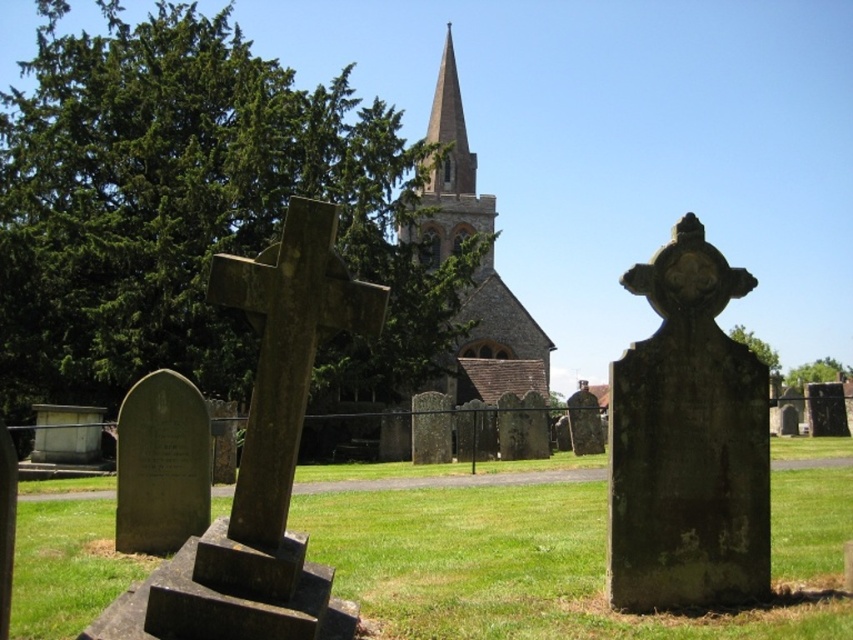
Question: Does brown stone cross at center lie behind smooth stone church steeple at center?

Choices:
 (A) yes
 (B) no

Answer: (B)

Question: Which point is farther to the camera?

Choices:
 (A) (544, 465)
 (B) (454, 115)
 (C) (245, 502)
 (D) (482, 384)

Answer: (B)

Question: Can you confirm if green grass at center is positioned below brown stone spire at center?

Choices:
 (A) yes
 (B) no

Answer: (A)

Question: Considering the relative positions of brown stone cross at center and smooth stone church steeple at center in the image provided, where is brown stone cross at center located with respect to smooth stone church steeple at center?

Choices:
 (A) right
 (B) left

Answer: (B)

Question: Which point is farther to the camera?

Choices:
 (A) brown stone spire at center
 (B) brown stone cross at center

Answer: (A)

Question: Which of the following is the farthest from the observer?

Choices:
 (A) (503, 355)
 (B) (573, 554)
 (C) (291, 358)

Answer: (A)